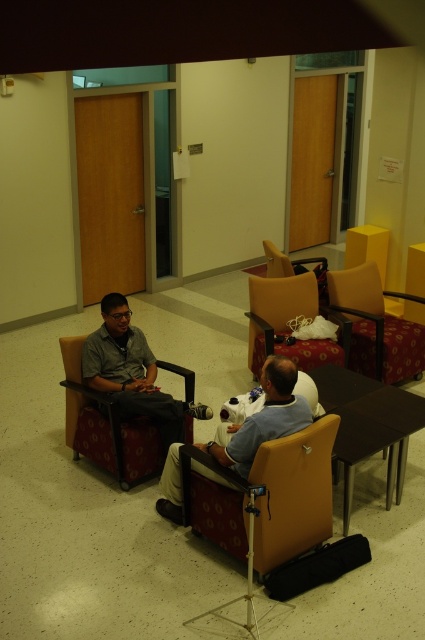
Question: Can you confirm if velvet-like brown armchair at left is wider than matte gray shirt at center?

Choices:
 (A) no
 (B) yes

Answer: (A)

Question: Can you confirm if light blue fabric shirt at center is positioned to the left of velvet-like brown armchair at center?

Choices:
 (A) no
 (B) yes

Answer: (B)

Question: Which object is closer to the camera taking this photo?

Choices:
 (A) matte gray shirt at center
 (B) velvet-like brown armchair at center

Answer: (A)

Question: Can you confirm if matte gray shirt at center is thinner than light blue fabric shirt at center?

Choices:
 (A) no
 (B) yes

Answer: (B)

Question: Which of the following is the closest to the observer?

Choices:
 (A) velvet-like brown armchair at center
 (B) matte gray shirt at center
 (C) light blue fabric shirt at center

Answer: (C)

Question: Which of the following is the farthest from the observer?

Choices:
 (A) light blue fabric shirt at center
 (B) velvet-like brown armchair at left
 (C) velvet-like brown armchair at center
 (D) matte gray shirt at center

Answer: (C)